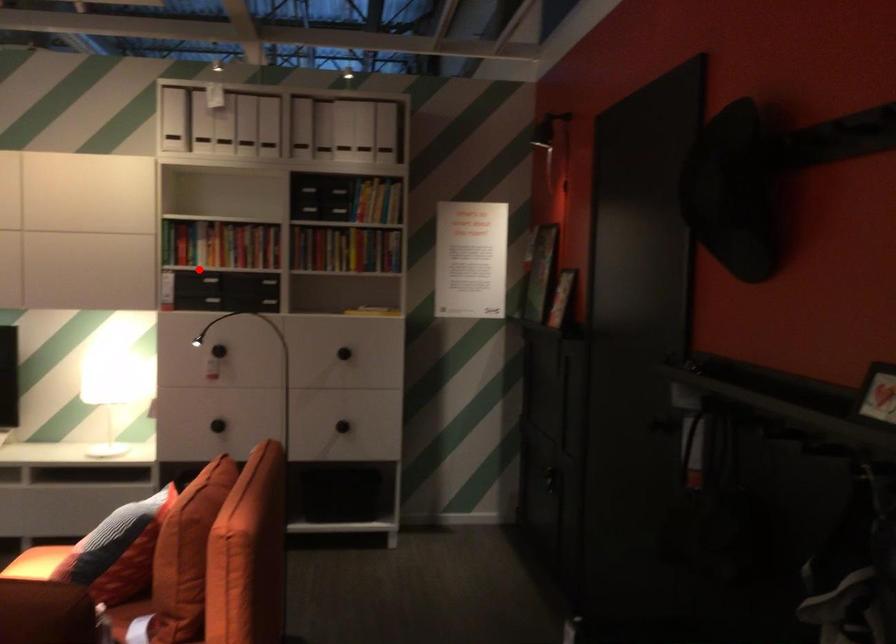
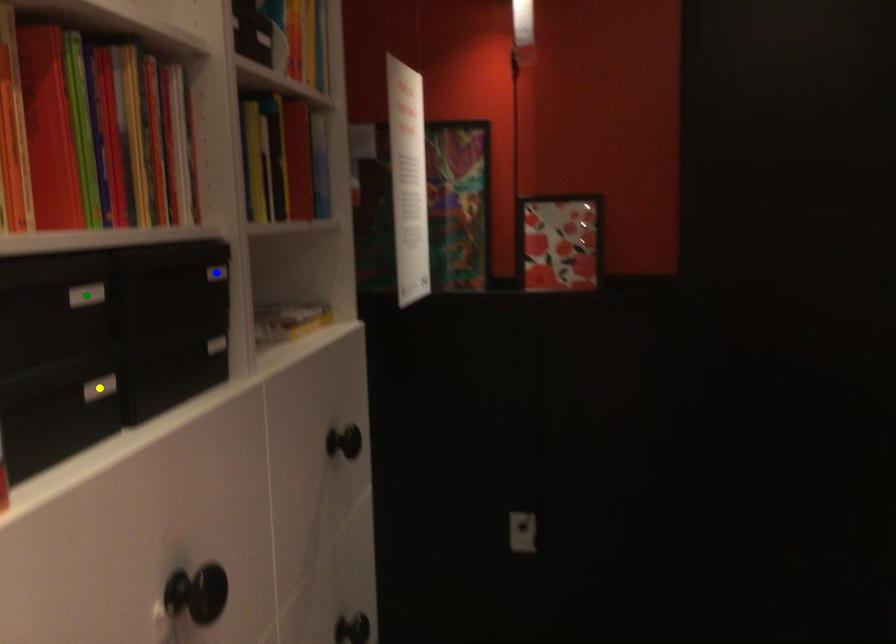
Question: I am providing you with two images of the same scene from different viewpoints. A red point is marked on the first image. You are given multiple points on the second image. Which spot in image 2 lines up with the point in image 1?

Choices:
 (A) yellow point
 (B) green point
 (C) blue point

Answer: (B)